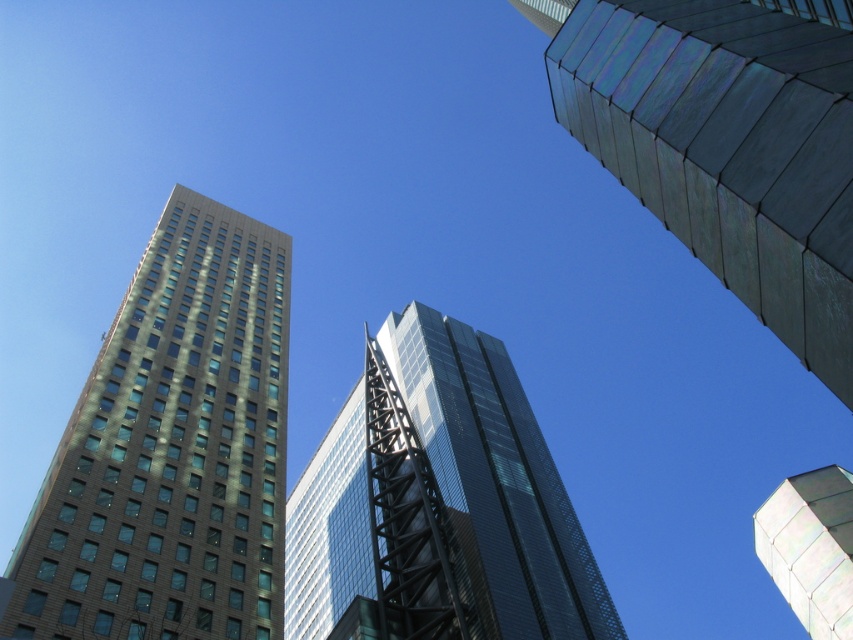
Question: Which point is farther from the camera taking this photo?

Choices:
 (A) (788, 522)
 (B) (277, 264)
 (C) (541, 552)

Answer: (B)

Question: Which object appears closest to the camera in this image?

Choices:
 (A) brown brick building at left
 (B) metallic silver tower at upper right
 (C) glassy reflective skyscraper at center

Answer: (A)

Question: Considering the relative positions of brown brick building at left and metallic silver tower at upper right in the image provided, where is brown brick building at left located with respect to metallic silver tower at upper right?

Choices:
 (A) left
 (B) right

Answer: (A)

Question: Estimate the real-world distances between objects in this image. Which object is farther from the brown brick building at left?

Choices:
 (A) metallic silver tower at upper right
 (B) glassy reflective skyscraper at center

Answer: (A)

Question: Does brown brick building at left lie in front of metallic silver tower at upper right?

Choices:
 (A) yes
 (B) no

Answer: (A)

Question: Does brown brick building at left appear over metallic silver tower at upper right?

Choices:
 (A) no
 (B) yes

Answer: (B)